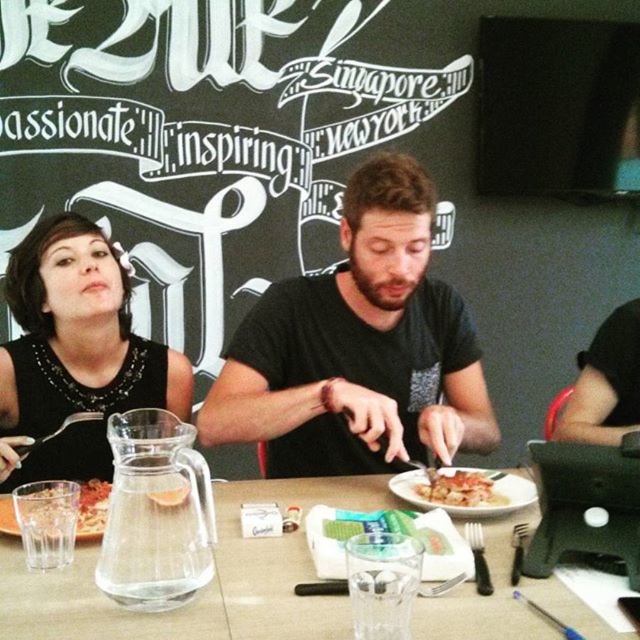
Between clear glass water at center and golden crispy chicken at center, which one has less height?

golden crispy chicken at center is shorter.

Who is positioned more to the left, clear glass water at center or golden crispy chicken at center?

clear glass water at center is more to the left.

Who is more distant from viewer, (328, 620) or (476, 490)?

The point (476, 490) is behind.

What are the coordinates of `clear glass water at center` in the screenshot? It's located at (205, 588).

Is black matte shirt at center closer to the viewer compared to translucent glass bowl at center?

No, it is not.

Can you confirm if black matte shirt at center is positioned above translucent glass bowl at center?

Correct, black matte shirt at center is located above translucent glass bowl at center.

Does point (426, 336) come farther from viewer compared to point (3, 497)?

Yes.

Where is `black matte shirt at center`? black matte shirt at center is located at coordinates (358, 348).

Between black matte shirt at center and black sequined dress at upper left, which one has less height?

With less height is black sequined dress at upper left.

Locate an element on the screen. The image size is (640, 640). black matte shirt at center is located at coordinates click(x=358, y=348).